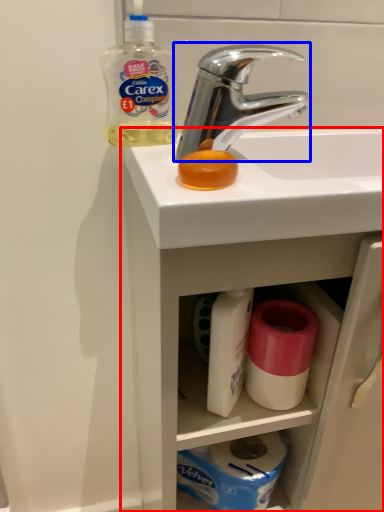
Question: Which of the following is the farthest to the observer, bathroom cabinet (highlighted by a red box) or tap (highlighted by a blue box)?

Choices:
 (A) bathroom cabinet
 (B) tap

Answer: (B)